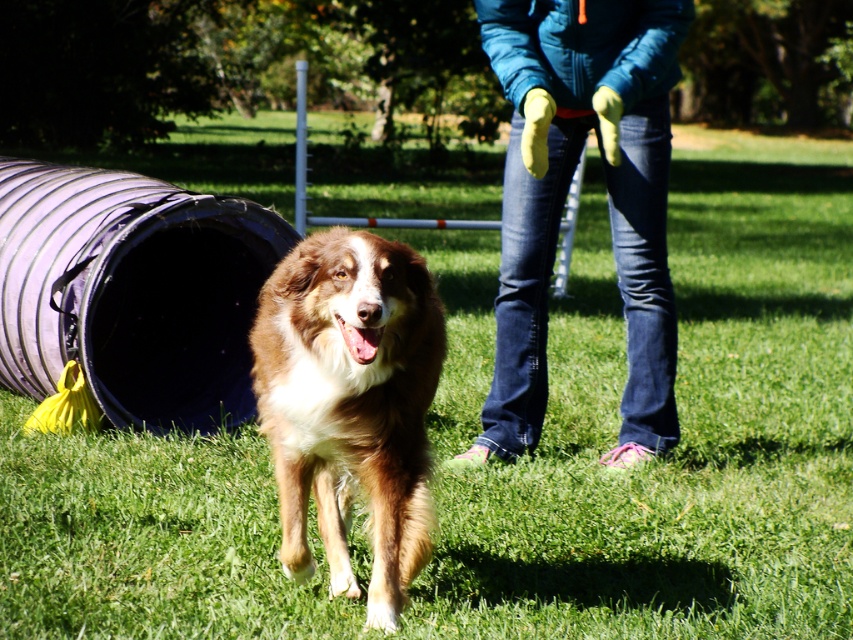
Question: Which point appears closest to the camera in this image?

Choices:
 (A) (180, 230)
 (B) (403, 588)
 (C) (653, 92)

Answer: (B)

Question: Does rubberized purple tunnel at left have a greater width compared to brown fluffy dog at center?

Choices:
 (A) no
 (B) yes

Answer: (B)

Question: Which object is closer to the camera taking this photo?

Choices:
 (A) denim jeans at center
 (B) brown fluffy dog at center

Answer: (B)

Question: Which object appears farthest from the camera in this image?

Choices:
 (A) denim jeans at center
 (B) brown fluffy dog at center

Answer: (A)

Question: Is denim jeans at center smaller than rubberized purple tunnel at left?

Choices:
 (A) yes
 (B) no

Answer: (A)

Question: In this image, where is denim jeans at center located relative to rubberized purple tunnel at left?

Choices:
 (A) above
 (B) below

Answer: (A)